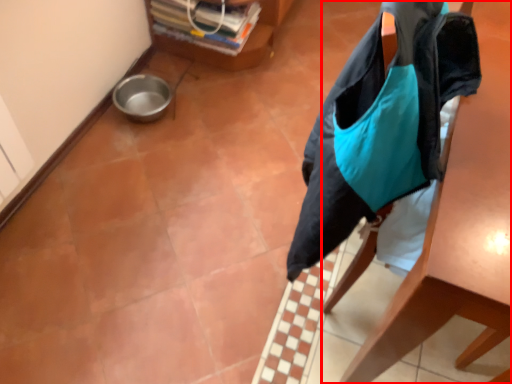
Question: From the image's perspective, where is furniture (annotated by the red box) located relative to furniture?

Choices:
 (A) below
 (B) above

Answer: (A)